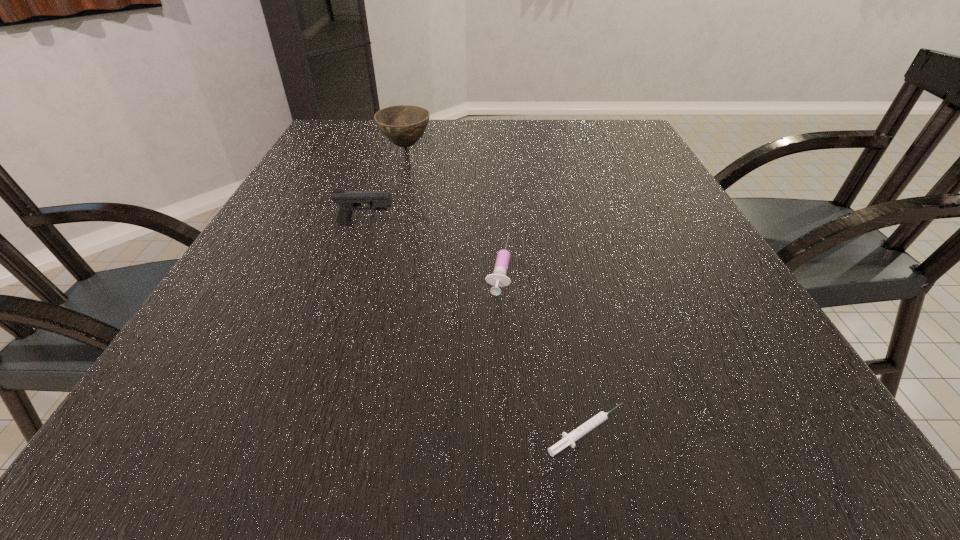
Locate an element on the screen. the farthest object is located at coordinates (403, 125).

Image resolution: width=960 pixels, height=540 pixels. Find the location of `pistol`. pistol is located at coordinates (348, 201).

This screenshot has width=960, height=540. Find the location of `the farther syringe`. the farther syringe is located at coordinates (499, 279).

Find the location of `the left syringe`. the left syringe is located at coordinates (499, 279).

Locate an element on the screen. the nearer syringe is located at coordinates tap(568, 439).

Where is `the nearest object`? the nearest object is located at coordinates (568, 439).

Identify the location of vacant space located 0.070m on the right of the farthest object. Image resolution: width=960 pixels, height=540 pixels. (457, 146).

The height and width of the screenshot is (540, 960). In order to click on vacant space located 0.300m at the barrel of the third nearest object in this screenshot , I will do `click(538, 225)`.

Find the location of a particular element. The width and height of the screenshot is (960, 540). vacant area situated on the front of the farther syringe is located at coordinates (501, 319).

Locate an element on the screen. Image resolution: width=960 pixels, height=540 pixels. vacant point located on the left of the nearer syringe is located at coordinates (283, 431).